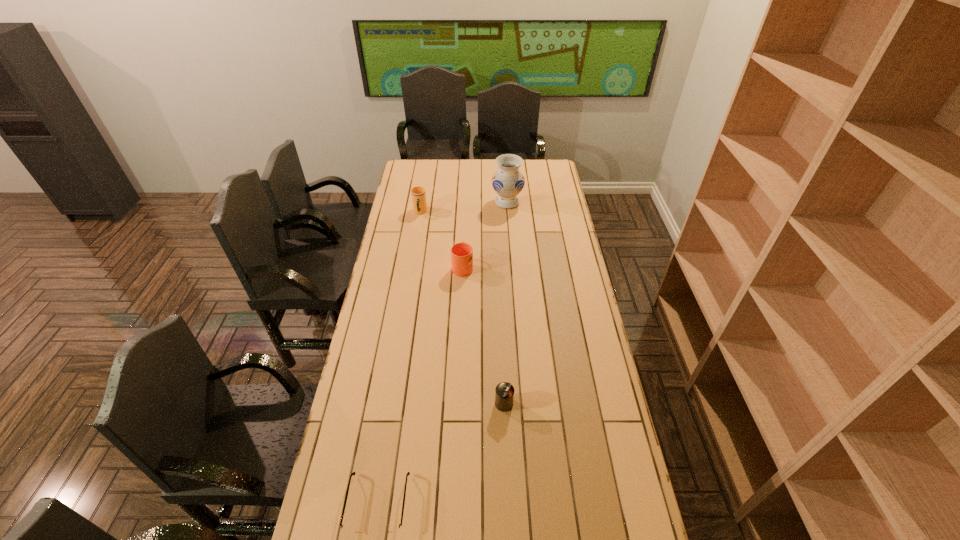
Identify the location of the tallest object. This screenshot has width=960, height=540. (508, 181).

Find the location of a particular element. cup is located at coordinates (418, 194).

Locate an element on the screen. The image size is (960, 540). the third object from right to left is located at coordinates (461, 253).

Find the location of a particular element. Image resolution: width=960 pixels, height=540 pixels. the third nearest object is located at coordinates (461, 253).

This screenshot has width=960, height=540. What are the coordinates of `the fourth farthest object` in the screenshot? It's located at (504, 393).

Where is `the nearest object`? This screenshot has height=540, width=960. the nearest object is located at coordinates (388, 529).

At what (x,y) coordinates should I click in order to perform the action: click on the shortest object. Please return your answer as a coordinate pair (x, y). The width and height of the screenshot is (960, 540). Looking at the image, I should click on (388, 529).

I want to click on vacant point located on the left of the vase, so click(x=458, y=202).

Identify the location of free spot located 0.230m on the side of the cup with the handle. The width and height of the screenshot is (960, 540). (414, 247).

At what (x,y) coordinates should I click in order to perform the action: click on vacant area situated 0.210m on the handle side of the mug. Please return your answer as a coordinate pair (x, y). Looking at the image, I should click on (465, 228).